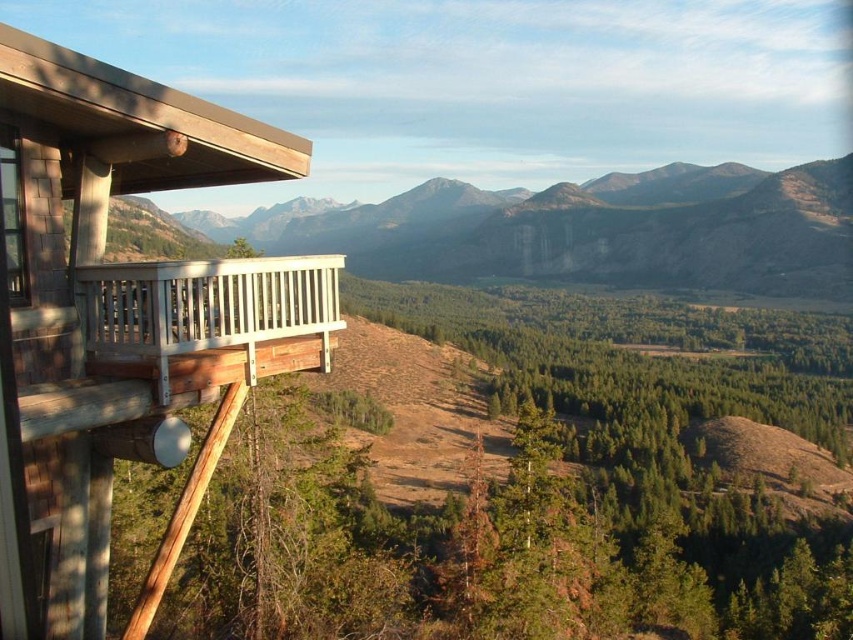
Does wooden cabin at left appear under white wood balcony at upper left?

Yes, wooden cabin at left is below white wood balcony at upper left.

Can you confirm if wooden cabin at left is wider than white wood balcony at upper left?

No.

Identify the location of wooden cabin at left. The width and height of the screenshot is (853, 640). (122, 321).